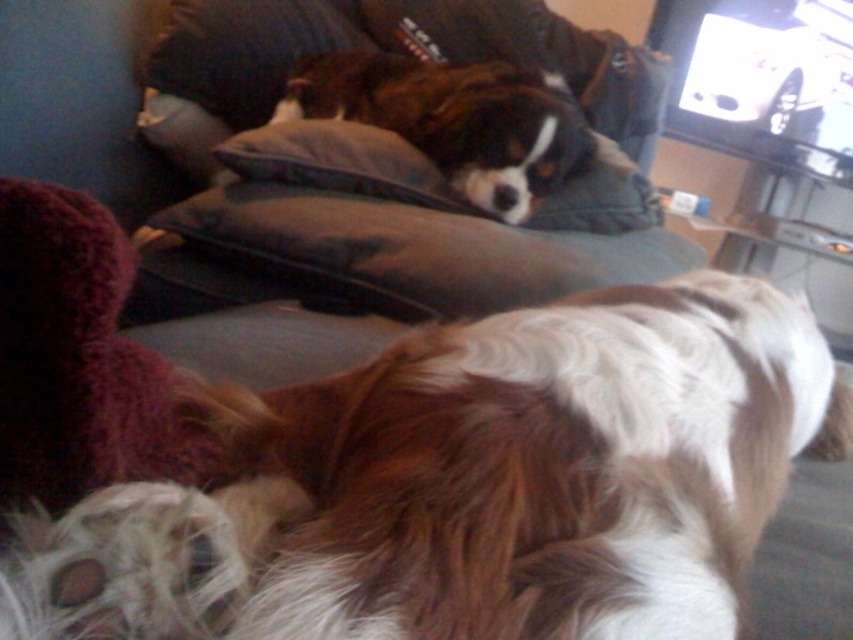
Based on the photo, you are trying to make space for a new throw pillow on the couch. You have to decide between removing either the dark gray cushion at center or the brown fur dog at center. Based on their sizes, which one should you remove to free up more space?

The dark gray cushion at center occupies less space than brown fur dog at center, so removing the brown fur dog at center would free up more space.

You are a photographer trying to capture the brown and white fur at center and the brown fur dog at center. Which one is positioned lower in the image?

The brown and white fur at center is positioned lower than the brown fur dog at center in the image.

You are standing in front of the couch where the two dogs are resting. You notice two points marked on the couch. The first point is at coordinates point (x=576, y=552) and the second is at point (x=531, y=106). From your perspective, which point is closer to you?

Point (x=576, y=552) is in front of point (x=531, y=106), so it is closer to you.